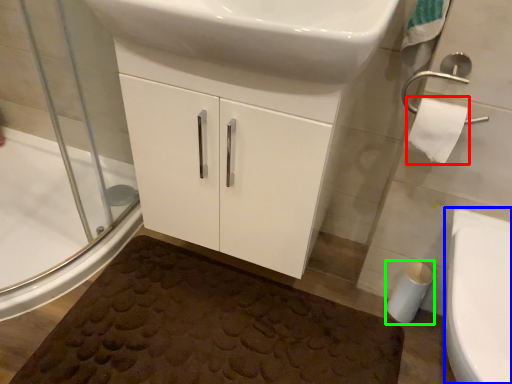
Question: Which is nearer to the toilet paper (highlighted by a red box)? bidet (highlighted by a blue box) or toilet paper (highlighted by a green box).

Choices:
 (A) bidet
 (B) toilet paper

Answer: (A)